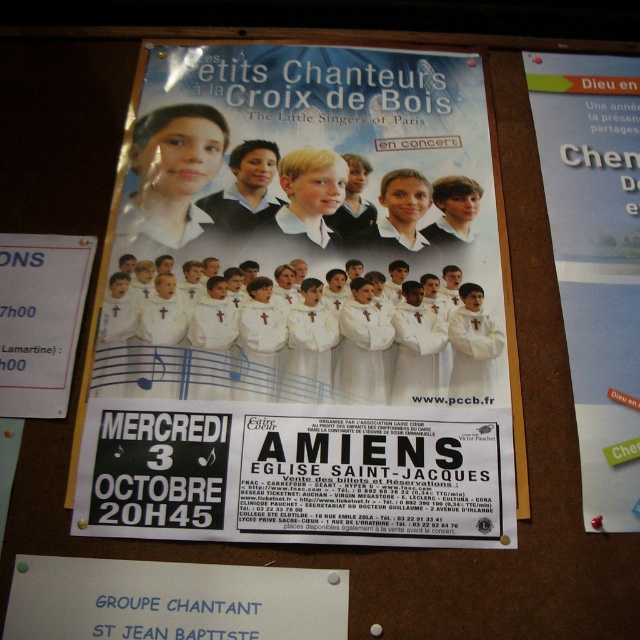
Who is taller, white paper poster at center or white paper at upper right?

white paper poster at center

Which is more to the right, white paper poster at center or white paper at upper right?

From the viewer's perspective, white paper at upper right appears more on the right side.

The width and height of the screenshot is (640, 640). What do you see at coordinates (305, 307) in the screenshot? I see `white paper poster at center` at bounding box center [305, 307].

This screenshot has height=640, width=640. What are the coordinates of `white paper poster at center` in the screenshot? It's located at (305, 307).